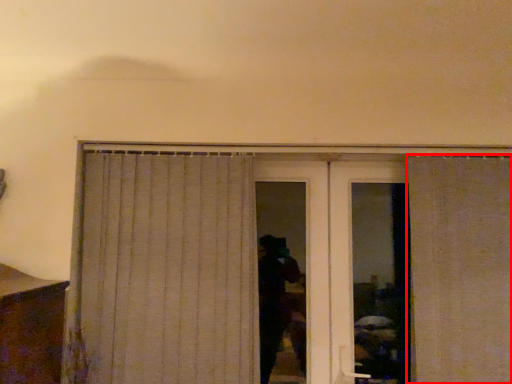
Question: From the image's perspective, where is curtain (annotated by the red box) located relative to curtain?

Choices:
 (A) above
 (B) below

Answer: (B)